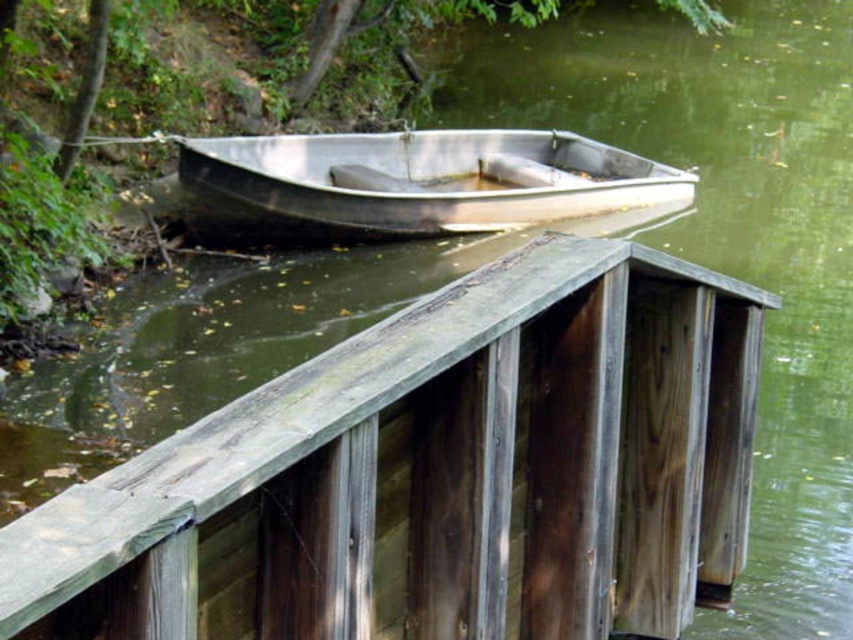
Can you confirm if weathered wood rail at center is positioned to the left of metallic silver boat at center?

No, weathered wood rail at center is not to the left of metallic silver boat at center.

Does weathered wood rail at center appear over metallic silver boat at center?

No, weathered wood rail at center is not above metallic silver boat at center.

The image size is (853, 640). What are the coordinates of `weathered wood rail at center` in the screenshot? It's located at (437, 474).